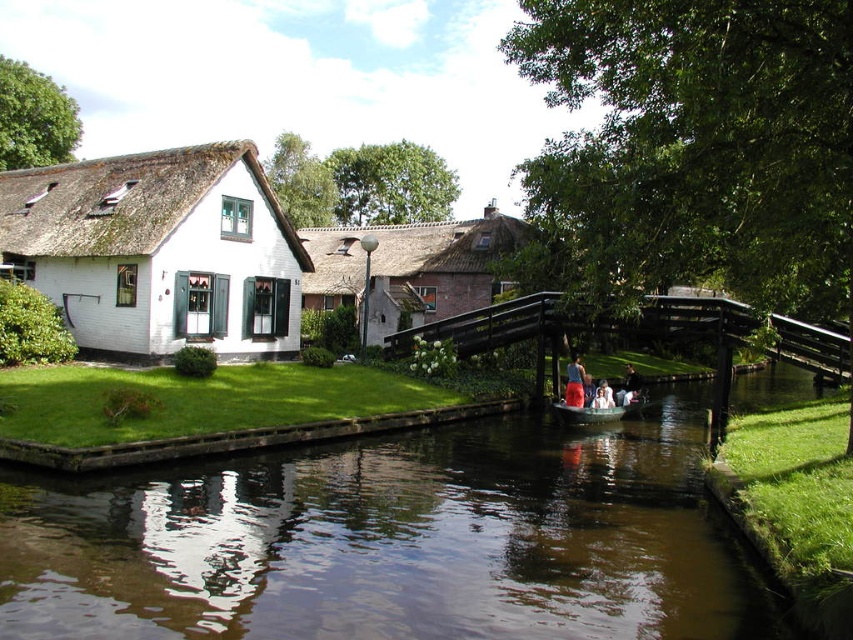
Based on the photo, you are standing at the wooden bridge and want to locate two points marked in the scene. Which point is closer to you, point [223,321] or point [334,307]?

Point [223,321] is in front of point [334,307], so it is closer to you.

You are standing on the wooden bridge and want to locate the point at coordinates [392,540]. Where would you find it?

The point at coordinates [392,540] is on the brown reflective water at center.

You are standing at the wooden bridge and want to take a photo of both point (590,554) and point (577,378) in the scene. Which point should you focus on first to ensure both are in the frame?

You should focus on point (590,554) first because it is closer to the camera than point (577,378), allowing both points to be captured within the frame.